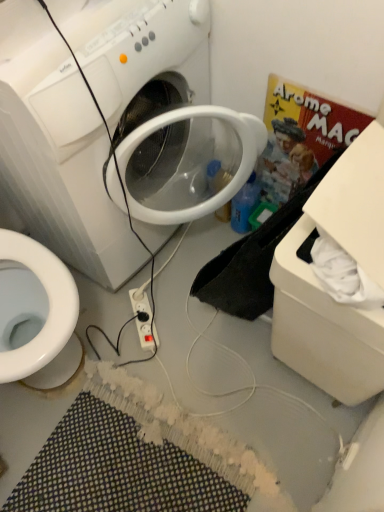
At what (x,y) coordinates should I click in order to perform the action: click on vacant space behind white plastic power outlet at center. Please return your answer as a coordinate pair (x, y). Looking at the image, I should click on (x=159, y=277).